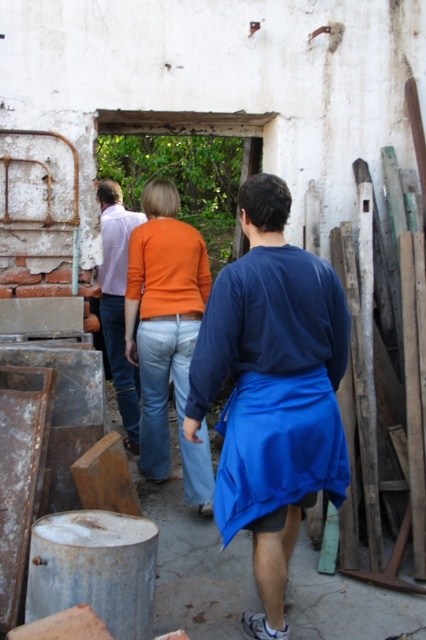
Question: Which object appears closest to the camera in this image?

Choices:
 (A) blue fabric apron at center
 (B) orange cotton shirt at center
 (C) matte purple shirt at center

Answer: (A)

Question: Where is blue fabric apron at center located in relation to matte purple shirt at center in the image?

Choices:
 (A) above
 (B) below

Answer: (B)

Question: Is blue fabric apron at center positioned at the back of matte purple shirt at center?

Choices:
 (A) yes
 (B) no

Answer: (B)

Question: Which object appears farthest from the camera in this image?

Choices:
 (A) blue fabric apron at center
 (B) matte purple shirt at center

Answer: (B)

Question: Which of the following is the closest to the observer?

Choices:
 (A) orange cotton shirt at center
 (B) matte purple shirt at center

Answer: (A)

Question: Can you confirm if blue fabric apron at center is positioned to the left of orange cotton shirt at center?

Choices:
 (A) no
 (B) yes

Answer: (A)